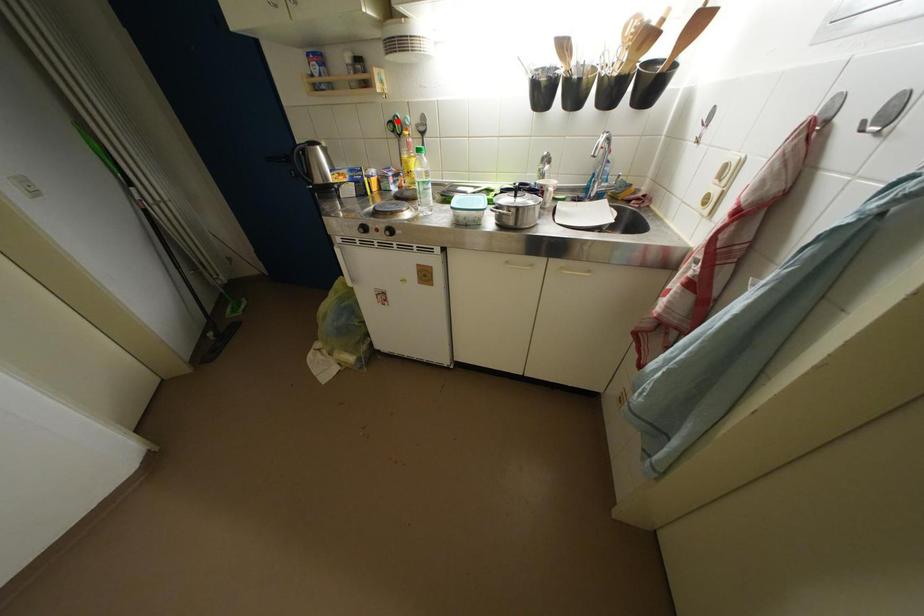
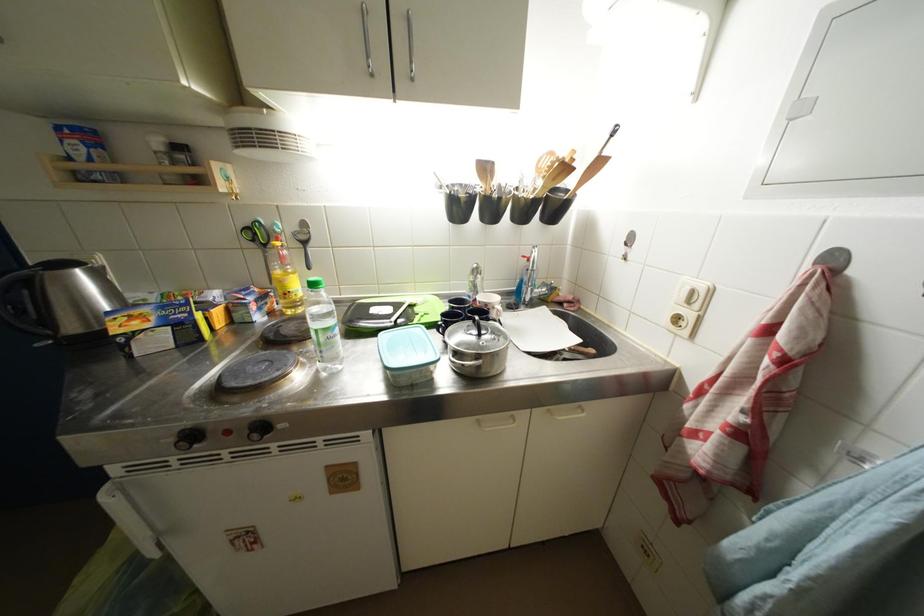
In the second image, find the point that corresponds to the highlighted location in the first image.

(253, 227)